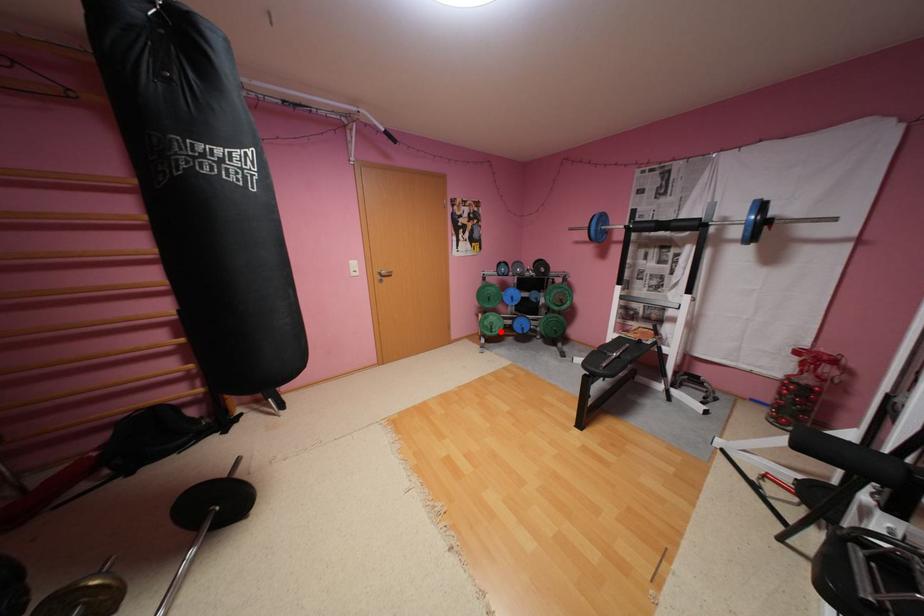
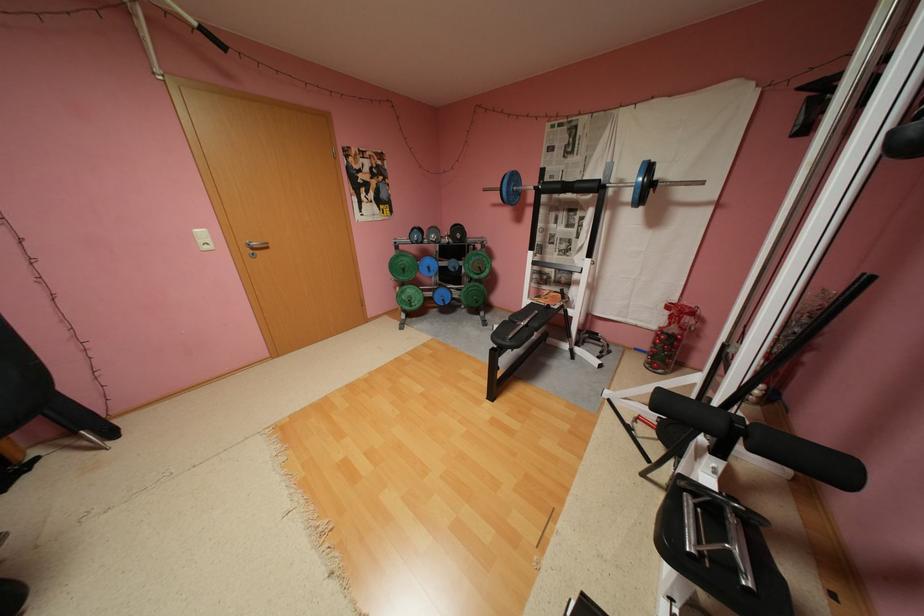
The point at the highlighted location is marked in the first image. Where is the corresponding point in the second image?

(419, 306)